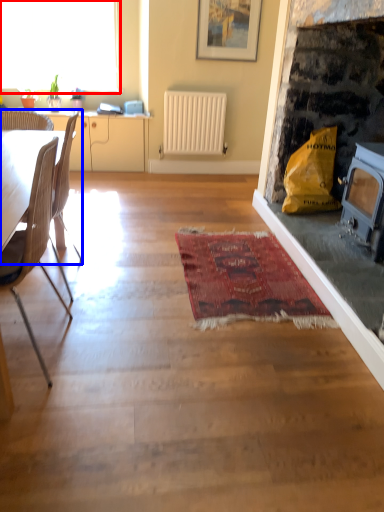
Question: Which object appears farthest to the camera in this image, window (highlighted by a red box) or chair (highlighted by a blue box)?

Choices:
 (A) window
 (B) chair

Answer: (A)